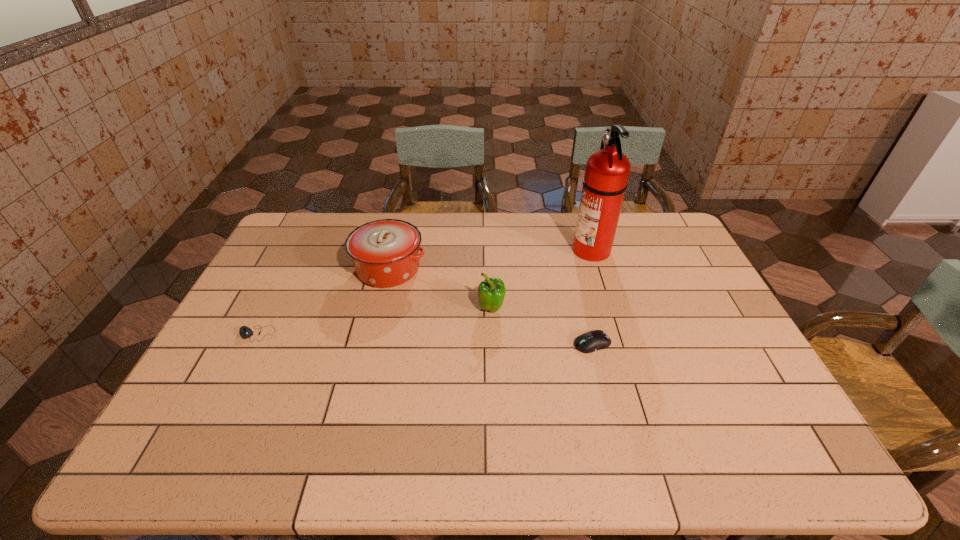
I want to click on free space at the left edge, so click(252, 294).

I want to click on vacant space at the right edge, so tap(714, 306).

At what (x,y) coordinates should I click in order to perform the action: click on free spot between the tallest object and the third farthest object. Please return your answer as a coordinate pair (x, y). This screenshot has height=540, width=960. Looking at the image, I should click on (541, 279).

Identify the location of vacant space that's between the shortest object and the third object from left to right. (373, 321).

At what (x,y) coordinates should I click in order to perform the action: click on vacant region between the tallest object and the right computer mouse. Please return your answer as a coordinate pair (x, y). Looking at the image, I should click on pos(592,296).

Image resolution: width=960 pixels, height=540 pixels. What are the coordinates of `free spot between the third object from left to right and the right computer mouse` in the screenshot? It's located at (541, 326).

The width and height of the screenshot is (960, 540). I want to click on unoccupied area between the shortest object and the casserole, so click(323, 301).

Find the location of a particular element. This screenshot has width=960, height=540. free spot between the fire extinguisher and the leftmost object is located at coordinates (424, 292).

Identify the location of unoccupied area between the shortest object and the tallest object. This screenshot has width=960, height=540. (424, 292).

Find the location of a particular element. Image resolution: width=960 pixels, height=540 pixels. vacant point located between the third farthest object and the taller computer mouse is located at coordinates (541, 326).